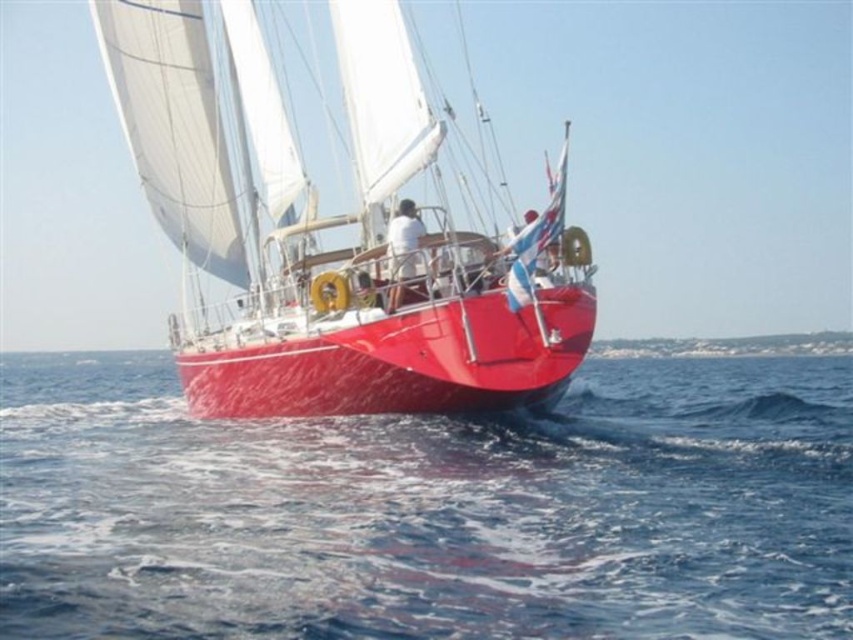
Is blue water at lower center smaller than shiny red sailboat at center?

Correct, blue water at lower center occupies less space than shiny red sailboat at center.

Is blue water at lower center thinner than shiny red sailboat at center?

In fact, blue water at lower center might be wider than shiny red sailboat at center.

What do you see at coordinates (430, 509) in the screenshot?
I see `blue water at lower center` at bounding box center [430, 509].

Where is `blue water at lower center`? blue water at lower center is located at coordinates (430, 509).